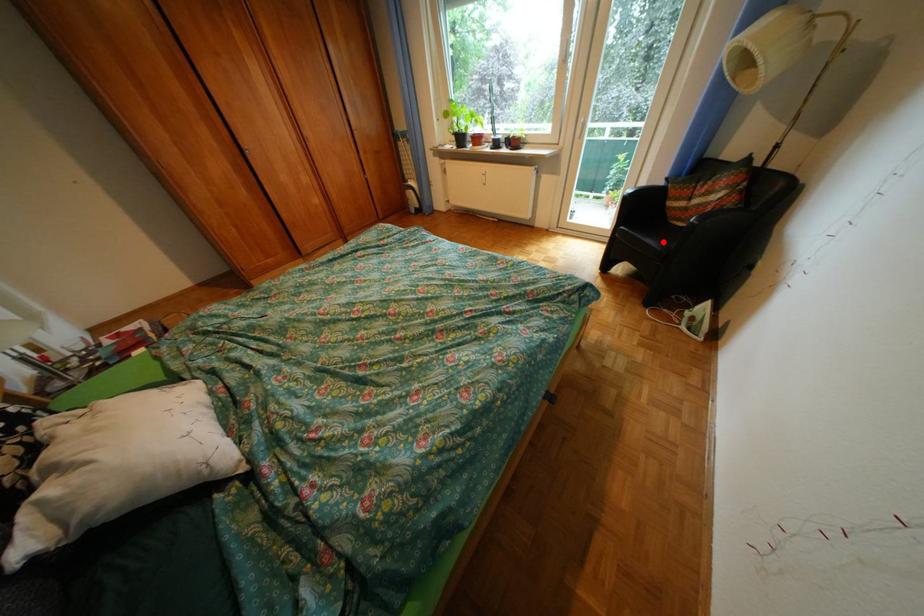
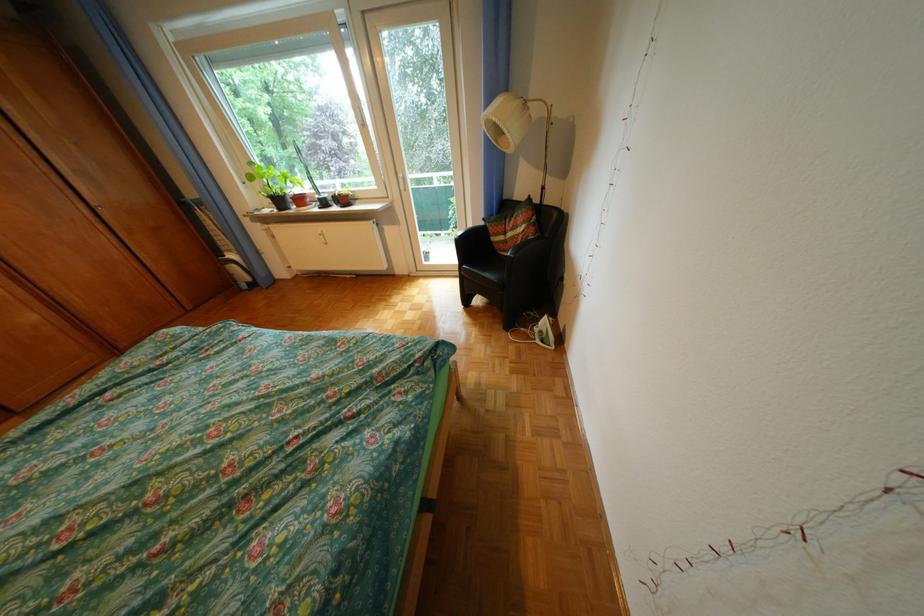
Locate, in the second image, the point that corresponds to the highlighted location in the first image.

(502, 276)